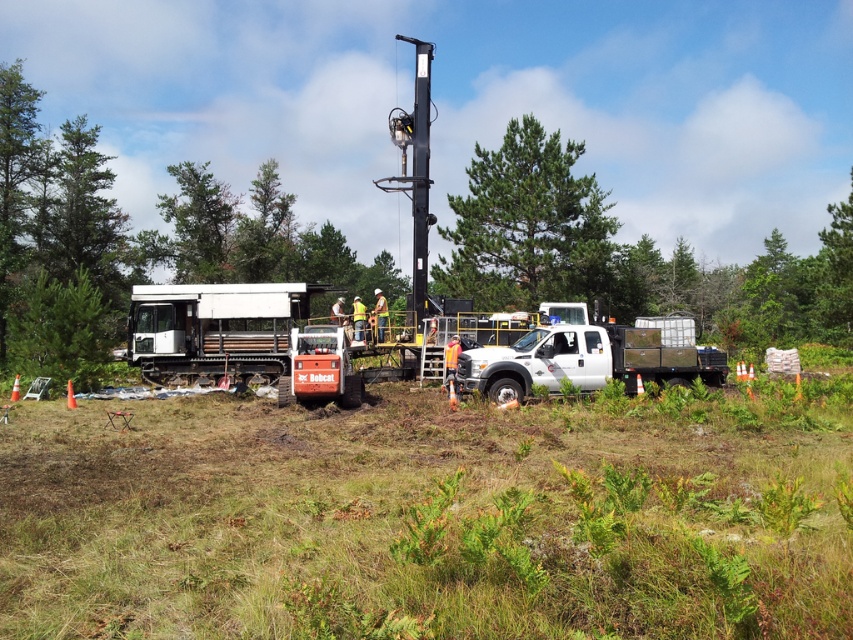
You are a construction worker who needs to move a heavy pipe from the white matte truck at center to the red Bobcat compact track loader next to the mobile drilling rig. Can you safely transport it without needing to move the truck? Explain your reasoning.

The white matte truck at center and the red Bobcat compact track loader are 16.61 meters apart. Since the distance is manageable for transporting the pipe manually or using the loader itself, there is no need to move the truck. The worker can safely carry or use equipment to move the pipe across the 16.61 meters between them.

Looking at this image, you are a construction worker who needs to park your vehicle. You have a white matte truck at center and a green leafy tree at upper center. Which object is located above the other?

The green leafy tree at upper center is located above the white matte truck at center.